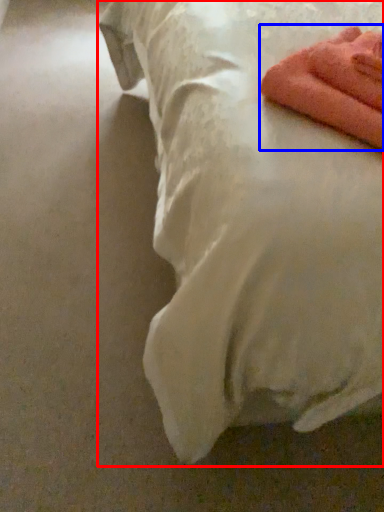
Question: Among these objects, which one is nearest to the camera, bed (highlighted by a red box) or towel (highlighted by a blue box)?

Choices:
 (A) bed
 (B) towel

Answer: (A)